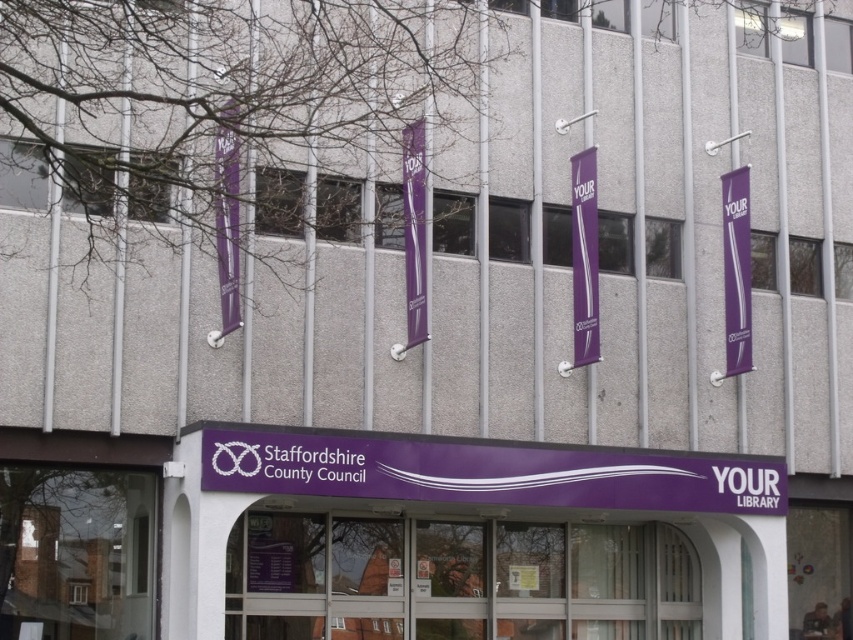
You are a visitor approaching the Staffordshire County Council building and notice two purple signs. The first is the purple matte signboard at center, and the second is the purple fabric banner at center. Which of these two signs is bigger?

The purple matte signboard at center is larger in size than the purple fabric banner at center.